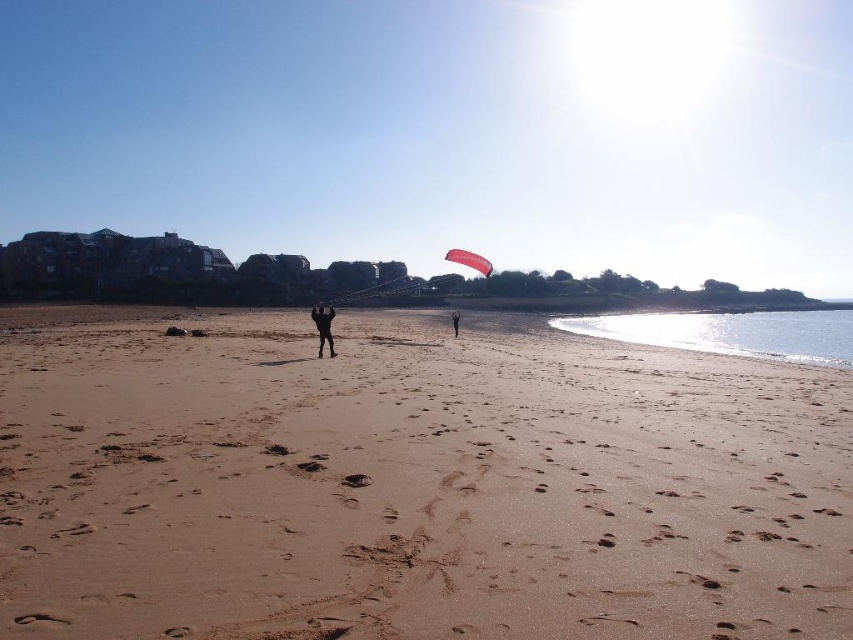
You are standing at the point labeled as point (410, 483). Looking around, you see the smooth sand at center. Which direction should you walk to reach the smooth sand at center?

You are already at the smooth sand at center, which is represented by point (410, 483).